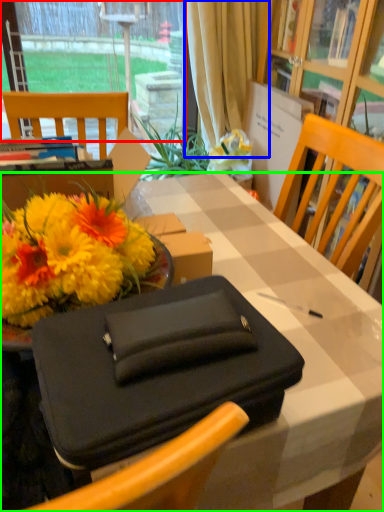
Question: Which is nearer to the window (highlighted by a red box)? curtain (highlighted by a blue box) or desk (highlighted by a green box).

Choices:
 (A) curtain
 (B) desk

Answer: (A)